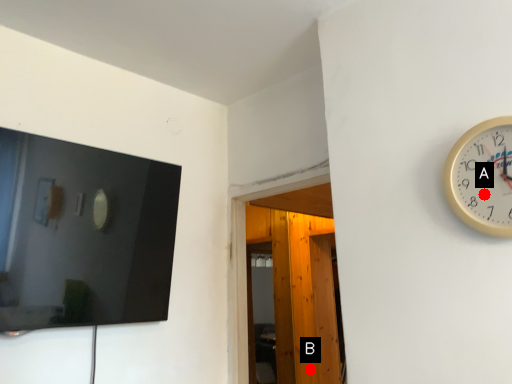
Question: Two points are circled on the image, labeled by A and B beside each circle. Among these points, which one is farthest from the camera?

Choices:
 (A) A is further
 (B) B is further

Answer: (B)